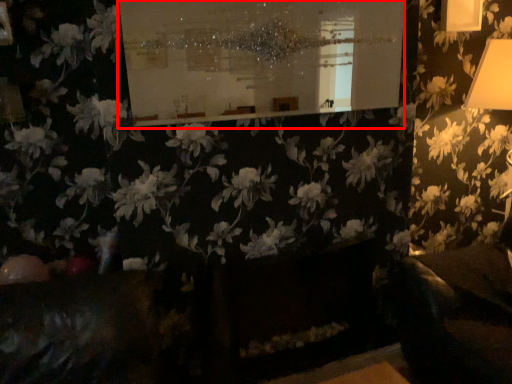
Question: In this image, where is bulletin board (annotated by the red box) located relative to flower?

Choices:
 (A) left
 (B) right

Answer: (A)